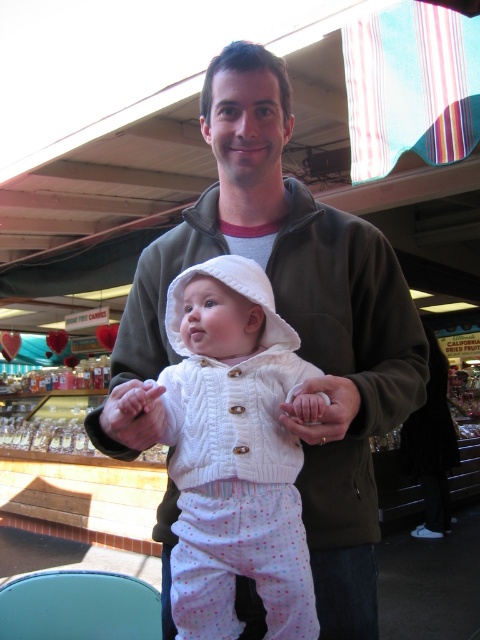
Question: Is white soft baby hand at center thinner than matte white hand at center?

Choices:
 (A) yes
 (B) no

Answer: (B)

Question: Among these points, which one is nearest to the camera?

Choices:
 (A) (155, 422)
 (B) (251, 156)
 (C) (340, 406)
 (D) (180, 394)

Answer: (C)

Question: Is the position of white soft baby hand at center less distant than that of matte white hand at center?

Choices:
 (A) yes
 (B) no

Answer: (A)

Question: Which point appears closest to the camera in this image?

Choices:
 (A) (322, 429)
 (B) (223, 593)
 (C) (305, 326)
 (D) (130, 412)

Answer: (D)

Question: Is white knitted sweater at center above matte white hand at center?

Choices:
 (A) yes
 (B) no

Answer: (B)

Question: Estimate the real-world distances between objects in this image. Which object is farther from the white soft baby hand at center?

Choices:
 (A) white knitted sweater at center
 (B) matte brown jacket at center

Answer: (B)